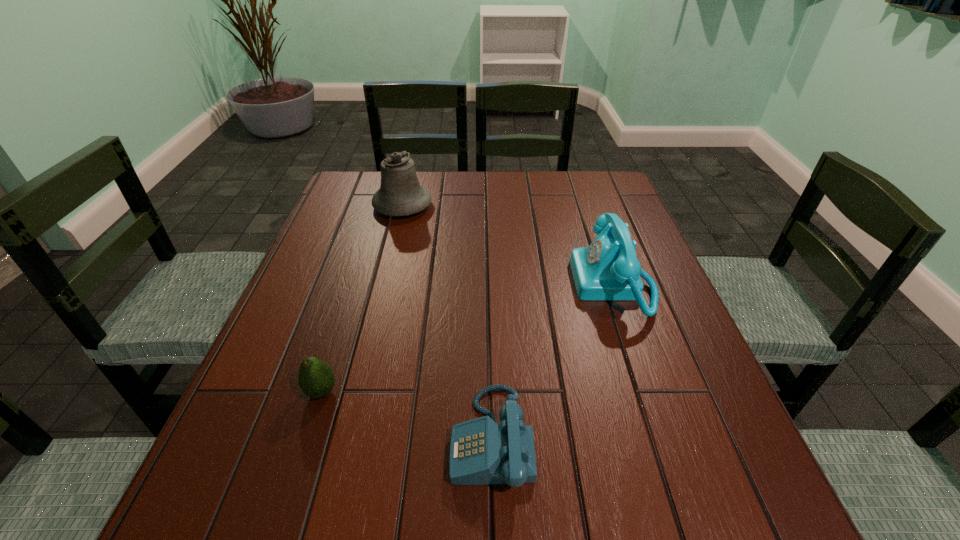
You are a GUI agent. You are given a task and a screenshot of the screen. Output one action in this format:
    pyautogui.click(x=<x>, y=<y>)
    Task: Click on the free space located on the back of the avocado
    
    Given the screenshot: What is the action you would take?
    pyautogui.click(x=362, y=265)

Image resolution: width=960 pixels, height=540 pixels. I want to click on free space located 0.260m on the dial of the third object from left to right, so click(297, 438).

At what (x,y) coordinates should I click in order to perform the action: click on vacant space located on the dial of the third object from left to right. Please return your answer as a coordinate pair (x, y). Looking at the image, I should click on (x=362, y=438).

Image resolution: width=960 pixels, height=540 pixels. Find the location of `vacant space located on the dial of the third object from left to right`. vacant space located on the dial of the third object from left to right is located at coordinates (397, 438).

Image resolution: width=960 pixels, height=540 pixels. I want to click on object that is at the far edge, so click(400, 194).

Find the location of a particular element. The image size is (960, 540). object located at the near edge is located at coordinates (482, 452).

The width and height of the screenshot is (960, 540). I want to click on bell situated at the left edge, so click(x=400, y=194).

This screenshot has height=540, width=960. Find the location of `avocado that is at the left edge`. avocado that is at the left edge is located at coordinates (316, 378).

Identify the location of object at the right edge. The height and width of the screenshot is (540, 960). (608, 269).

Locate an element on the screen. Image resolution: width=960 pixels, height=540 pixels. object present at the far left corner is located at coordinates (400, 194).